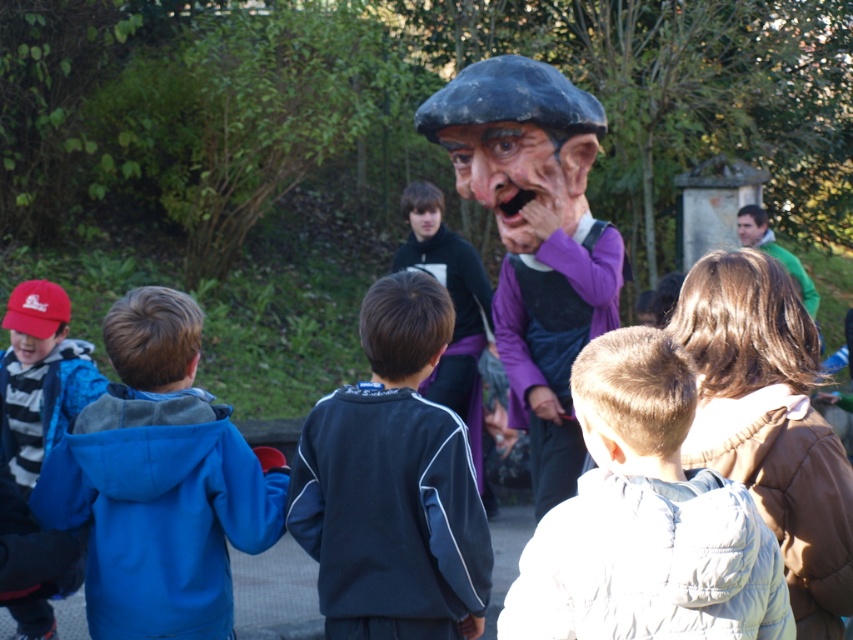
You are an event planner setting up a Halloween display. You have two items to place on a stand for the figure of an old man. The items are the matte purple costume at center and the matte purple mask at center. According to the scene, where should you position them relative to each other?

The matte purple costume at center should be placed below the matte purple mask at center, as the costume is located below the mask in the scene.

You are a costume designer trying to determine which item to store first in a limited space. Given the scene with the matte purple costume at center and the matte purple mask at center, which item requires more storage space?

The matte purple costume at center is larger in size than the matte purple mask at center, so it requires more storage space.

You are standing at the center of the scene. Which direction should you walk to reach the white puffy jacket at lower right?

Since the white puffy jacket at lower right is located at coordinates 0.811 on the x axis and 0.757 on the y axis, which is towards the lower right corner of the scene, you should walk towards the lower right direction to reach it.